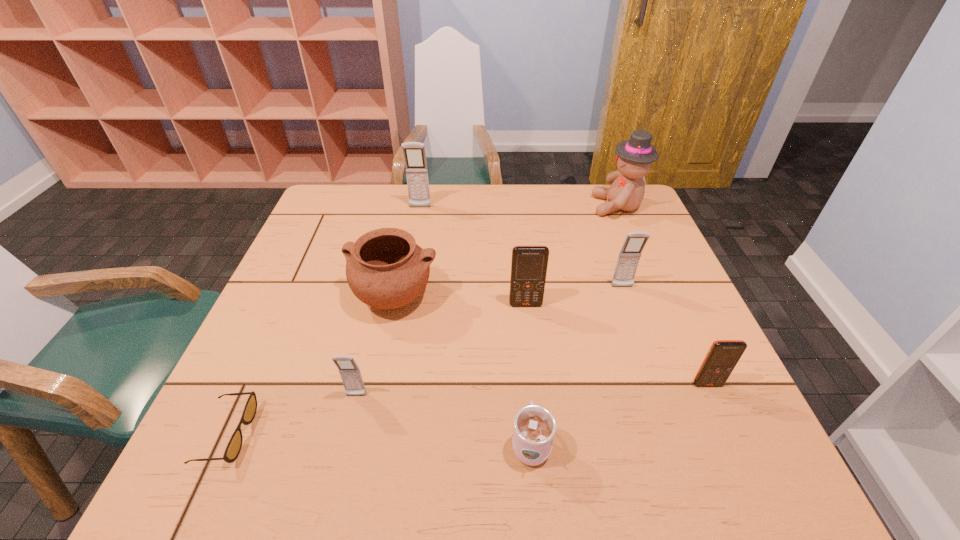
I want to click on cup situated at the near edge, so click(534, 426).

At what (x,y) coordinates should I click in order to perform the action: click on sunglasses at the near edge. Please return your answer as a coordinate pair (x, y). The image size is (960, 540). Looking at the image, I should click on (233, 448).

Locate an element on the screen. object at the left edge is located at coordinates (233, 448).

Where is `rag_doll at the right edge`? The height and width of the screenshot is (540, 960). rag_doll at the right edge is located at coordinates (634, 157).

Where is `object that is positioned at the near left corner`? This screenshot has width=960, height=540. object that is positioned at the near left corner is located at coordinates (233, 448).

Locate an element on the screen. The height and width of the screenshot is (540, 960). object that is at the far right corner is located at coordinates (634, 157).

This screenshot has width=960, height=540. I want to click on vacant space at the far edge of the desktop, so click(x=459, y=216).

Find the location of a particular element. The height and width of the screenshot is (540, 960). free space at the near edge of the desktop is located at coordinates (474, 461).

You are a GUI agent. You are given a task and a screenshot of the screen. Output one action in this format:
    pyautogui.click(x=<x>, y=<y>)
    Task: Click on the vacant space at the left edge
    
    Given the screenshot: What is the action you would take?
    pyautogui.click(x=287, y=351)

In the image, there is a desktop. Where is `vacant space at the right edge`? The height and width of the screenshot is (540, 960). vacant space at the right edge is located at coordinates (660, 386).